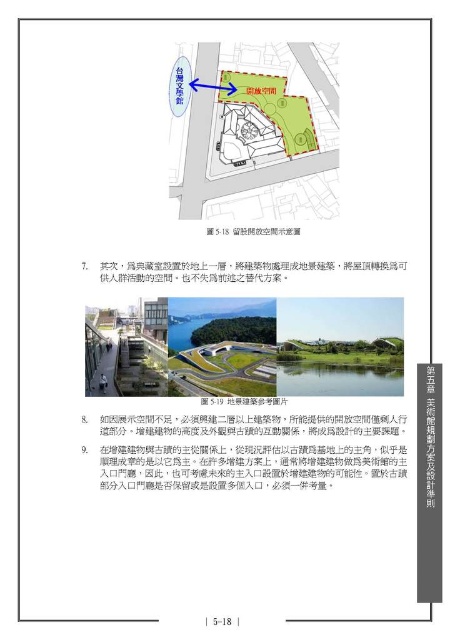
You are an urban planner reviewing this architectural plan. You see the green matte building at center and the green reflective water at center. Which one is positioned to the left?

The green matte building at center is positioned to the left of the green reflective water at center.

You are reviewing an architectural plan for a museum complex. You notice two points labeled as coordinates on the blueprint. Based on the plan, can you determine if the point at coordinate point (234, 186) is positioned behind the point at coordinate point (369, 394) from the viewer perspective?

Yes, according to the plan, point (234, 186) is behind point (369, 394) from the viewer perspective.

In the scene shown: You are an architect reviewing a design plan for a museum complex. The plan shows a green matte building at center and a green reflective water at center. According to the scale provided in the scene, how far apart are these two features in inches?

The green matte building at center is 18.32 inches away from green reflective water at center according to the scale in the scene.